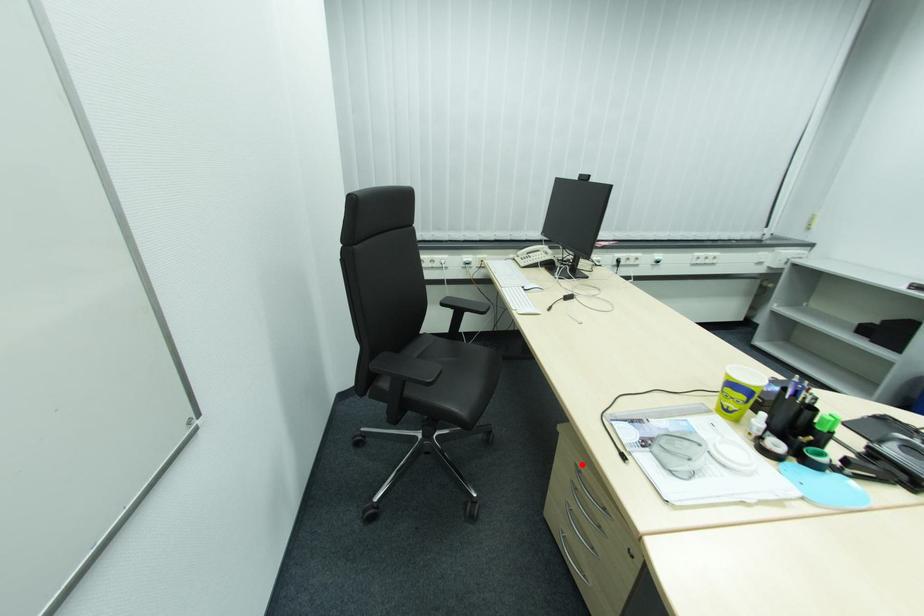
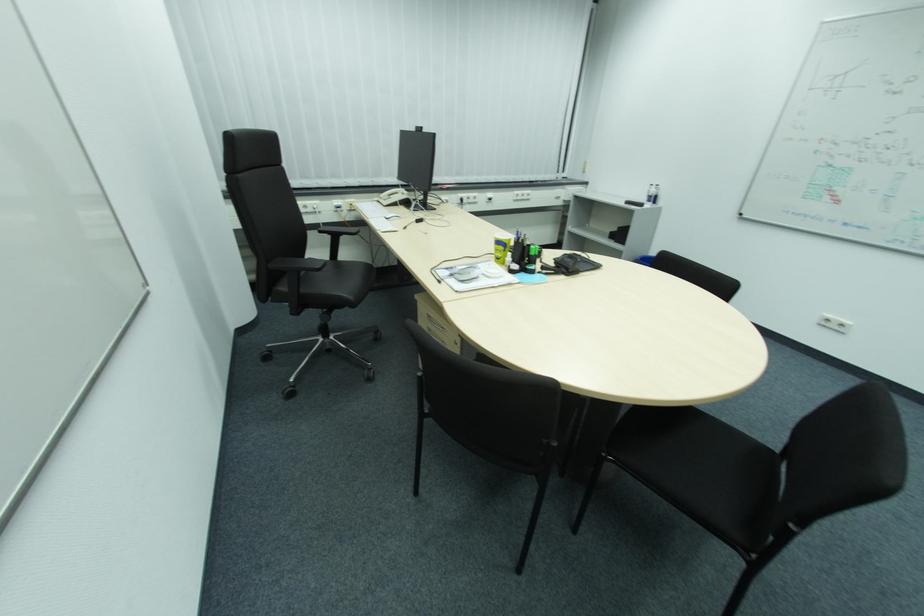
Question: I am providing you with two images of the same scene from different viewpoints. Image1 has a red point marked. In image2, the corresponding 3D location appears at what relative position? Reply with the corresponding letter.

Choices:
 (A) Closer
 (B) Farther

Answer: (B)